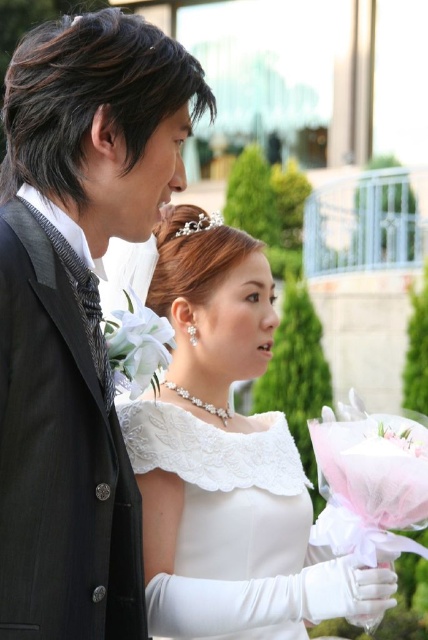
Question: Among these objects, which one is nearest to the camera?

Choices:
 (A) matte black suit at left
 (B) white lace wedding dress at center
 (C) pearl/textured hair accessory at upper center
 (D) white lace dress at center

Answer: (D)

Question: Which point is farther from the camera taking this photo?

Choices:
 (A) (201, 230)
 (B) (154, 324)

Answer: (A)

Question: Can you confirm if white lace dress at center is bigger than white silk flower at center?

Choices:
 (A) yes
 (B) no

Answer: (A)

Question: Does matte black suit at left have a larger size compared to white lace dress at center?

Choices:
 (A) no
 (B) yes

Answer: (A)

Question: Is matte black suit at left below white lace dress at center?

Choices:
 (A) yes
 (B) no

Answer: (B)

Question: Which object is farther from the camera taking this photo?

Choices:
 (A) white silk flower at center
 (B) pearl/textured hair accessory at upper center
 (C) white lace dress at center
 (D) matte black suit at left

Answer: (B)